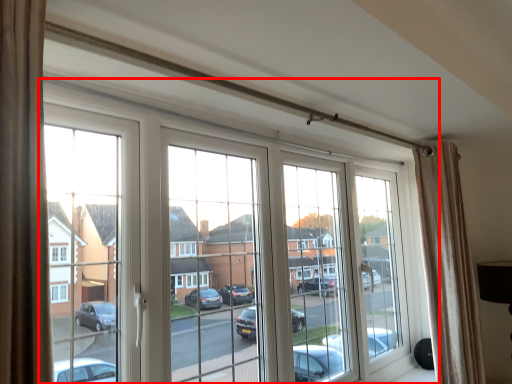
Question: Where is window (annotated by the red box) located in relation to curtain in the image?

Choices:
 (A) left
 (B) right

Answer: (A)